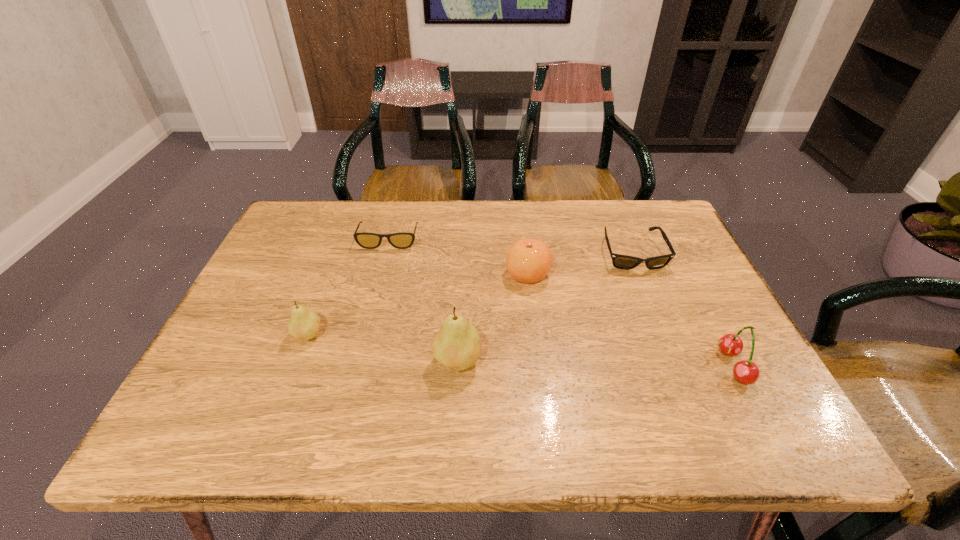
Find the location of a particular element. free space that satisfies the following two spatial constraints: 1. on the front-facing side of the second object from left to right; 2. on the left side of the clementine is located at coordinates (380, 274).

Locate an element on the screen. vacant space that satisfies the following two spatial constraints: 1. on the front-facing side of the second object from left to right; 2. on the left side of the taller pear is located at coordinates (358, 361).

This screenshot has height=540, width=960. Find the location of `vacant area that satisfies the following two spatial constraints: 1. on the front-facing side of the fifth object from right to left; 2. on the right side of the fourth object from right to left`. vacant area that satisfies the following two spatial constraints: 1. on the front-facing side of the fifth object from right to left; 2. on the right side of the fourth object from right to left is located at coordinates (358, 361).

Identify the location of vacant space that satisfies the following two spatial constraints: 1. on the front-facing side of the taller pear; 2. on the left side of the left sunglasses. [x=358, y=361].